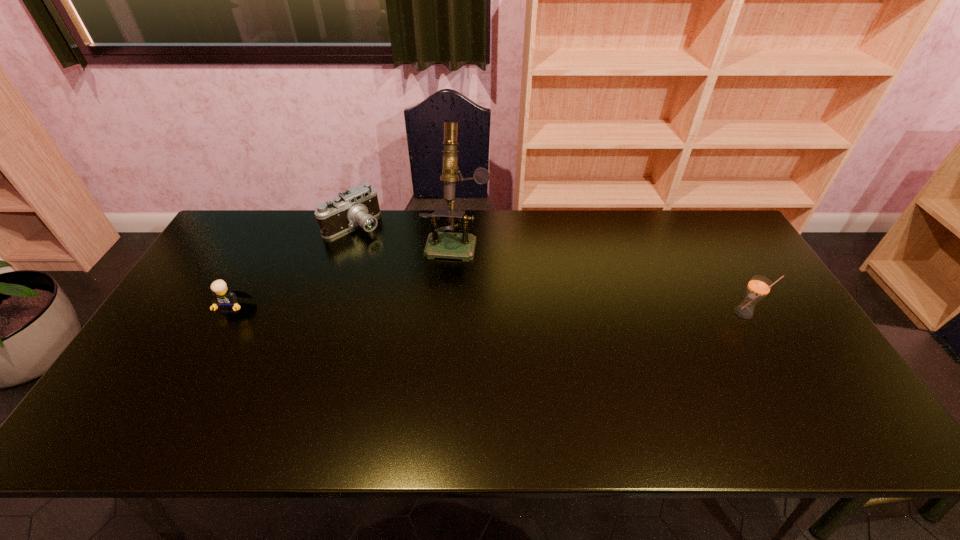
You are a GUI agent. You are given a task and a screenshot of the screen. Output one action in this format:
    pyautogui.click(x=<x>, y=<y>)
    Task: Click on the free region located 0.180m at the eyepiece of the microscope
    The width and height of the screenshot is (960, 540).
    Given the screenshot: What is the action you would take?
    pyautogui.click(x=443, y=302)

I want to click on free point located 0.150m at the lens of the second object from left to right, so click(386, 262).

This screenshot has height=540, width=960. I want to click on vacant space located at the lens of the second object from left to right, so click(x=404, y=284).

Find the location of a particular element. vacant space located 0.070m at the lens of the second object from left to right is located at coordinates (375, 248).

Where is `microscope that is positioned at the far edge`? The height and width of the screenshot is (540, 960). microscope that is positioned at the far edge is located at coordinates (450, 245).

The height and width of the screenshot is (540, 960). I want to click on camera present at the far edge, so click(x=359, y=205).

The image size is (960, 540). Identify the location of object that is at the left edge. (226, 299).

At what (x,y) coordinates should I click in order to perform the action: click on object at the right edge. Please return your answer as a coordinate pair (x, y). Looking at the image, I should click on (758, 287).

This screenshot has width=960, height=540. I want to click on vacant space at the far edge of the desktop, so click(386, 214).

Image resolution: width=960 pixels, height=540 pixels. In the image, there is a desktop. Identify the location of free space at the near edge. (408, 397).